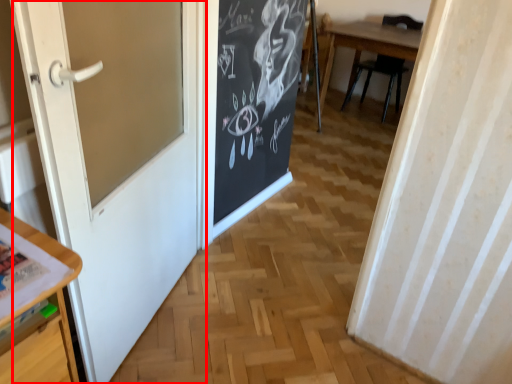
Question: From the image's perspective, where is door (annotated by the red box) located in relation to chair in the image?

Choices:
 (A) below
 (B) above

Answer: (A)